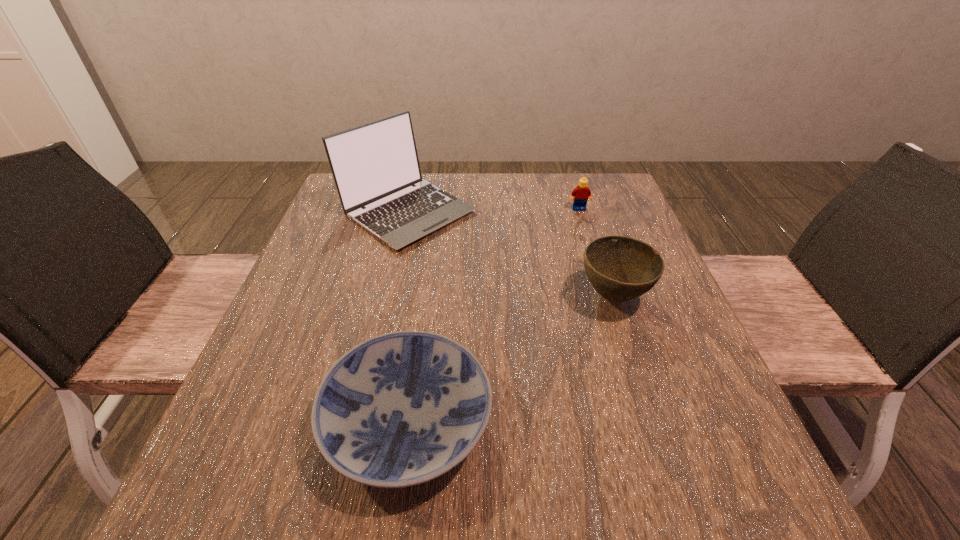
In the image, there is a desktop. Where is `blank space at the near edge`? This screenshot has width=960, height=540. blank space at the near edge is located at coordinates (479, 482).

I want to click on free space at the left edge of the desktop, so click(x=239, y=465).

Locate an element on the screen. vacant space at the right edge of the desktop is located at coordinates (593, 226).

In the image, there is a desktop. Identify the location of vacant space at the near left corner. (250, 491).

The image size is (960, 540). I want to click on free space at the far right corner of the desktop, so click(x=612, y=175).

Locate an element on the screen. unoccupied position between the plate and the Lego is located at coordinates (493, 315).

Where is `free space between the bowl and the nearest object`? The width and height of the screenshot is (960, 540). free space between the bowl and the nearest object is located at coordinates (511, 359).

Identify the location of vacant point located between the laptop_computer and the second nearest object. The width and height of the screenshot is (960, 540). (511, 254).

The image size is (960, 540). Find the location of `unoccupied position between the laptop_computer and the third farthest object`. unoccupied position between the laptop_computer and the third farthest object is located at coordinates (511, 254).

Find the location of a particular element. free space between the shortest object and the second nearest object is located at coordinates (511, 359).